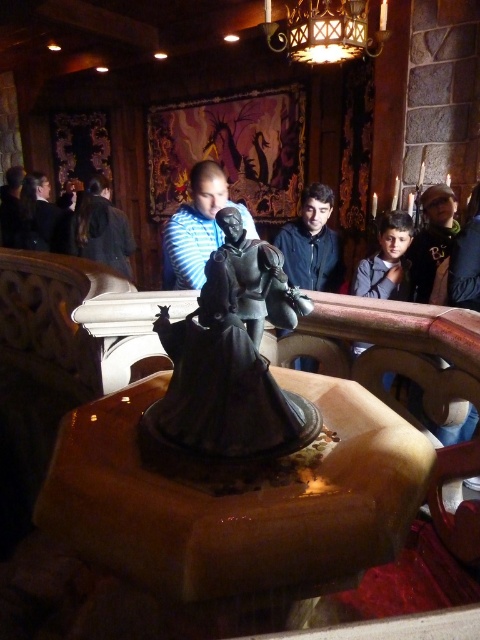
Is striped shirt at center above dark blue shirt at left?

Incorrect, striped shirt at center is not positioned above dark blue shirt at left.

Is striped shirt at center further to the viewer compared to dark blue shirt at left?

No, striped shirt at center is closer to the viewer.

You are a GUI agent. You are given a task and a screenshot of the screen. Output one action in this format:
    pyautogui.click(x=<x>, y=<y>)
    Task: Click on the striped shirt at center
    Image resolution: width=480 pixels, height=640 pixels.
    Given the screenshot: What is the action you would take?
    pyautogui.click(x=197, y=228)

The height and width of the screenshot is (640, 480). What do you see at coordinates (325, 29) in the screenshot? I see `metallic gold chandelier at upper center` at bounding box center [325, 29].

Who is more distant from viewer, (x=296, y=6) or (x=334, y=268)?

Point (x=334, y=268)

Identify the location of metallic gold chandelier at upper center. This screenshot has height=640, width=480. (325, 29).

Which is behind, point (305, 428) or point (238, 208)?

Point (238, 208)

Can you confirm if shiny bronze statue at center is positioned to the left of striped shirt at center?

In fact, shiny bronze statue at center is to the right of striped shirt at center.

The width and height of the screenshot is (480, 640). What do you see at coordinates (232, 356) in the screenshot?
I see `shiny bronze statue at center` at bounding box center [232, 356].

Locate an element on the screen. The height and width of the screenshot is (640, 480). shiny bronze statue at center is located at coordinates (232, 356).